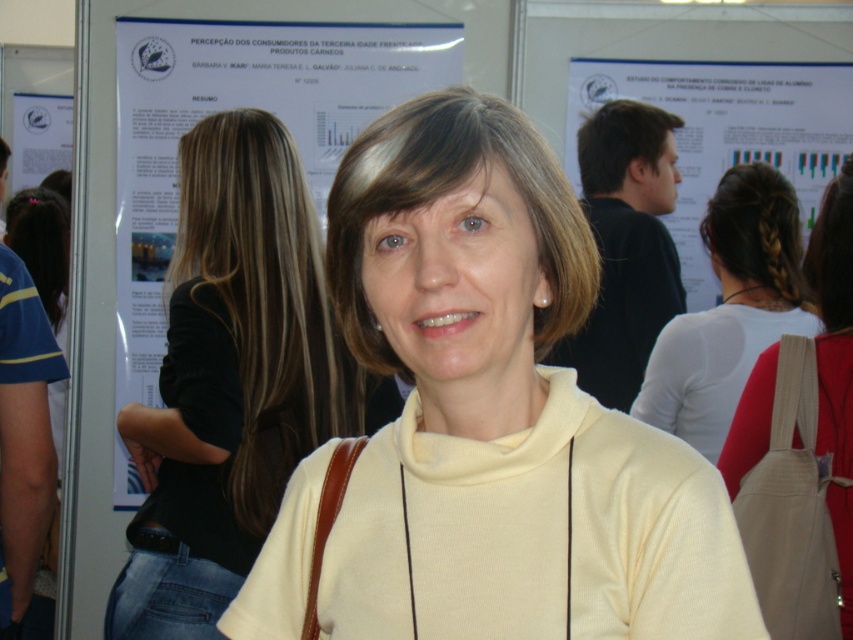
You are attending a conference and need to locate the program schedule. The beige fabric bag at upper right and the white paper at upper left are both visible in the background. Which one is positioned lower in the image?

The beige fabric bag at upper right is positioned lower than the white paper at upper left because it is below it.

You are an event photographer at the conference. You need to capture a clear shot of the light yellow sweater at center and the brown smooth hair at upper center. Which object should you focus on first to ensure both are in focus?

The light yellow sweater at center is closer to the viewer than the brown smooth hair at upper center. To ensure both are in focus, you should focus on the light yellow sweater at center first, as it is closer, and the depth of field will likely include the brown smooth hair at upper center in the background.

You are taking a photo of the woman in the conference setting. The two points in the image are part of a critical feature you need to capture. Which of the two points, point (451, 484) or point (44, 173), will appear larger in your photo?

Point (451, 484) will appear larger in the photo because it is closer to the camera than point (44, 173).